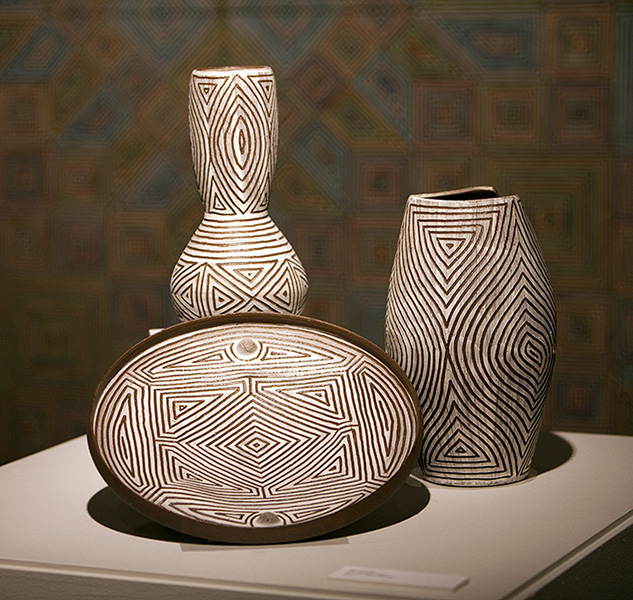
Image resolution: width=633 pixels, height=600 pixels. I want to click on short, stubby object, possibly a vase, so click(x=502, y=338).